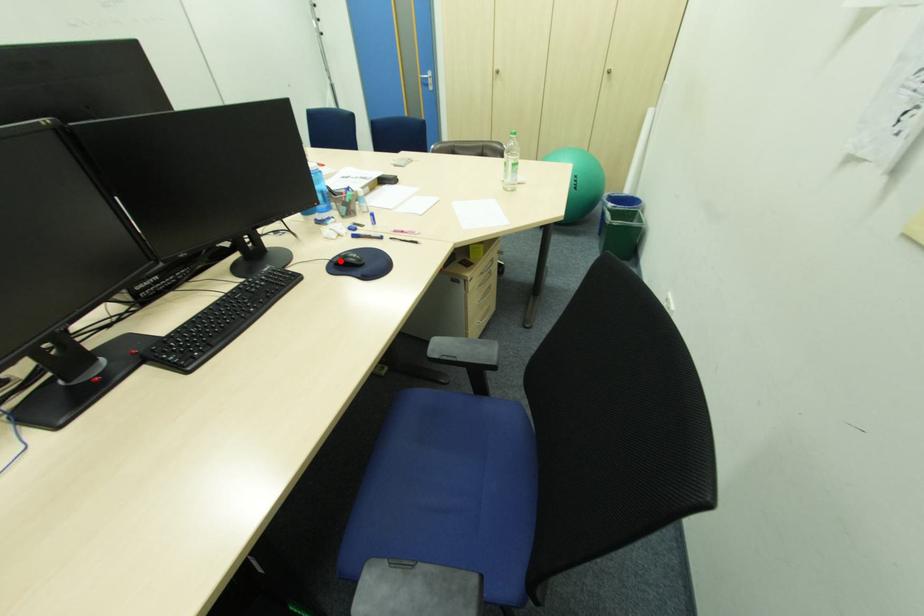
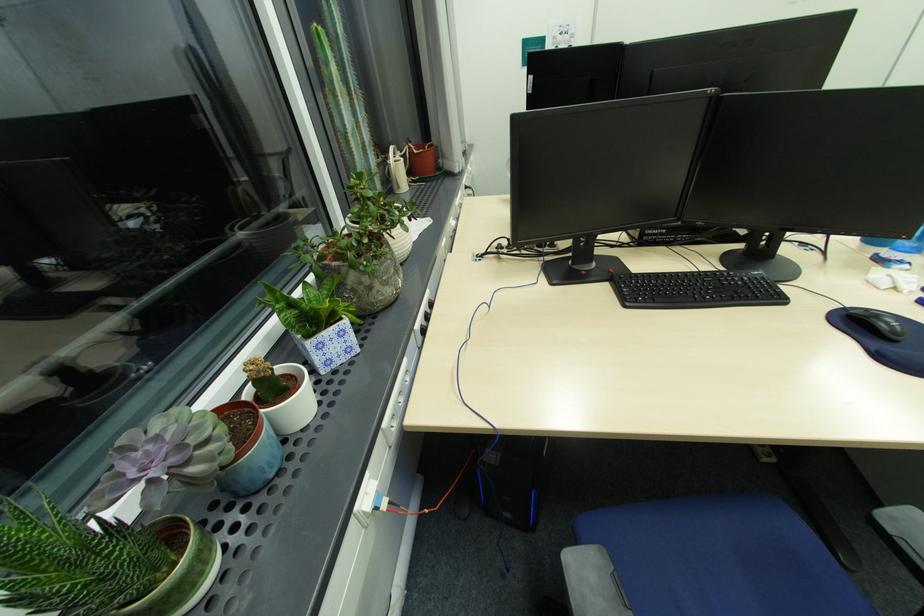
Question: I am providing you with two images of the same scene from different viewpoints. A red point is marked on the first image. Can you still see the location of the red point in image 2?

Choices:
 (A) Yes
 (B) No

Answer: (A)